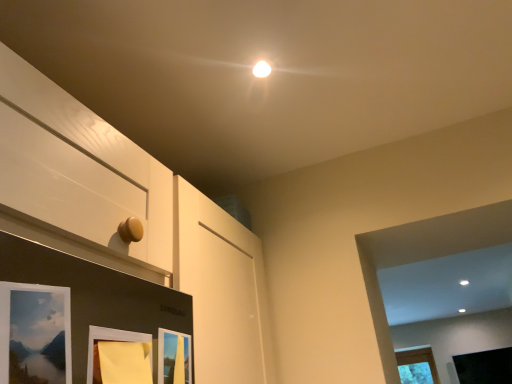
Question: Is yellow paper at lower center, positioned as the 2th picture frame in left-to-right order, completely or partially outside of matte wooden picture frame at lower center, which is the 2th picture frame in back-to-front order?

Choices:
 (A) yes
 (B) no

Answer: (A)

Question: Is yellow paper at lower center, arranged as the second picture frame when viewed from the front, oriented towards matte wooden picture frame at lower center, which is the 2th picture frame in back-to-front order?

Choices:
 (A) yes
 (B) no

Answer: (B)

Question: Can you confirm if yellow paper at lower center, which appears as the 2th picture frame when viewed from the top, is thinner than matte wooden picture frame at lower center, the third picture frame viewed from the top?

Choices:
 (A) no
 (B) yes

Answer: (A)

Question: Is yellow paper at lower center, which appears as the 2th picture frame when viewed from the top, directly adjacent to matte wooden picture frame at lower center, which is the second picture frame from right to left?

Choices:
 (A) no
 (B) yes

Answer: (B)

Question: Considering the relative sizes of yellow paper at lower center, which appears as the 2th picture frame when viewed from the top, and matte wooden picture frame at lower center, which is the 2th picture frame in back-to-front order, in the image provided, is yellow paper at lower center, which appears as the 2th picture frame when viewed from the top, taller than matte wooden picture frame at lower center, which is the 2th picture frame in back-to-front order,?

Choices:
 (A) yes
 (B) no

Answer: (B)

Question: Considering their positions, is matte wooden picture frame at lower left, which is the first picture frame in left-to-right order, located in front of or behind yellow paper at lower center, arranged as the second picture frame when viewed from the front?

Choices:
 (A) front
 (B) behind

Answer: (A)

Question: Based on their sizes in the image, would you say matte wooden picture frame at lower left, which is the first picture frame in left-to-right order, is bigger or smaller than yellow paper at lower center, which appears as the 2th picture frame when viewed from the top?

Choices:
 (A) big
 (B) small

Answer: (A)

Question: From the image's perspective, is matte wooden picture frame at lower left, positioned as the fourth picture frame in right-to-left order, above or below yellow paper at lower center, arranged as the 3th picture frame when viewed from the back?

Choices:
 (A) below
 (B) above

Answer: (B)

Question: Considering the positions of point (11, 334) and point (129, 339), is point (11, 334) closer or farther from the camera than point (129, 339)?

Choices:
 (A) farther
 (B) closer

Answer: (B)

Question: Would you say yellow paper at lower center, arranged as the second picture frame when viewed from the front, is to the left or to the right of matte wooden picture frame at lower left, which is the first picture frame in left-to-right order, in the picture?

Choices:
 (A) left
 (B) right

Answer: (B)

Question: From their relative heights in the image, would you say yellow paper at lower center, the third picture frame in the bottom-to-top sequence, is taller or shorter than matte wooden picture frame at lower left, which ranks as the 4th picture frame in bottom-to-top order?

Choices:
 (A) short
 (B) tall

Answer: (A)

Question: Does point (131, 357) appear closer or farther from the camera than point (48, 370)?

Choices:
 (A) closer
 (B) farther

Answer: (B)

Question: Is yellow paper at lower center, the 3th picture frame in the right-to-left sequence, in front of or behind matte wooden picture frame at lower left, acting as the fourth picture frame starting from the back, in the image?

Choices:
 (A) front
 (B) behind

Answer: (B)

Question: Considering the positions of point (97, 367) and point (485, 379), is point (97, 367) closer or farther from the camera than point (485, 379)?

Choices:
 (A) farther
 (B) closer

Answer: (B)

Question: Looking at their shapes, would you say yellow paper at lower center, the third picture frame in the bottom-to-top sequence, is wider or thinner than black matte picture frame at lower right, the 1th picture frame when ordered from bottom to top?

Choices:
 (A) wide
 (B) thin

Answer: (B)